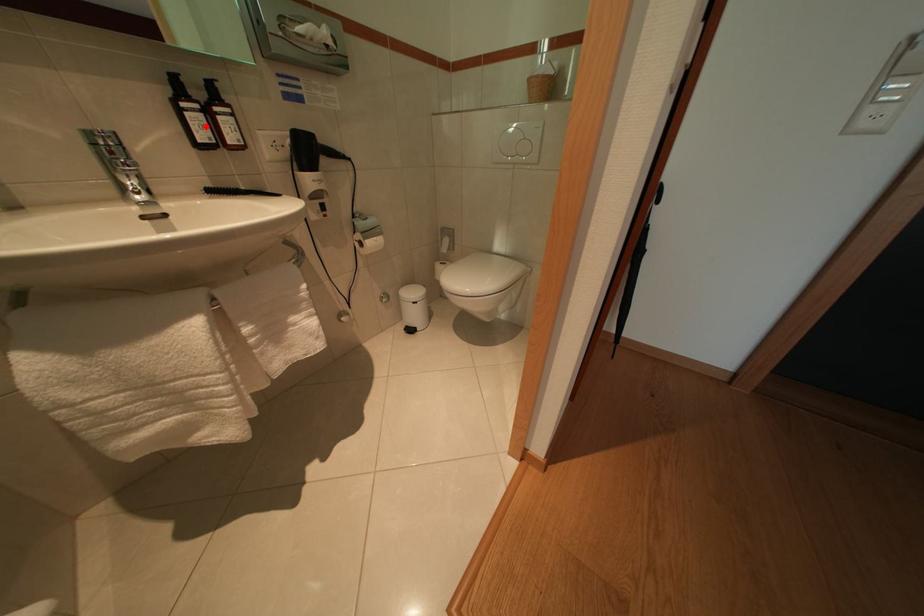
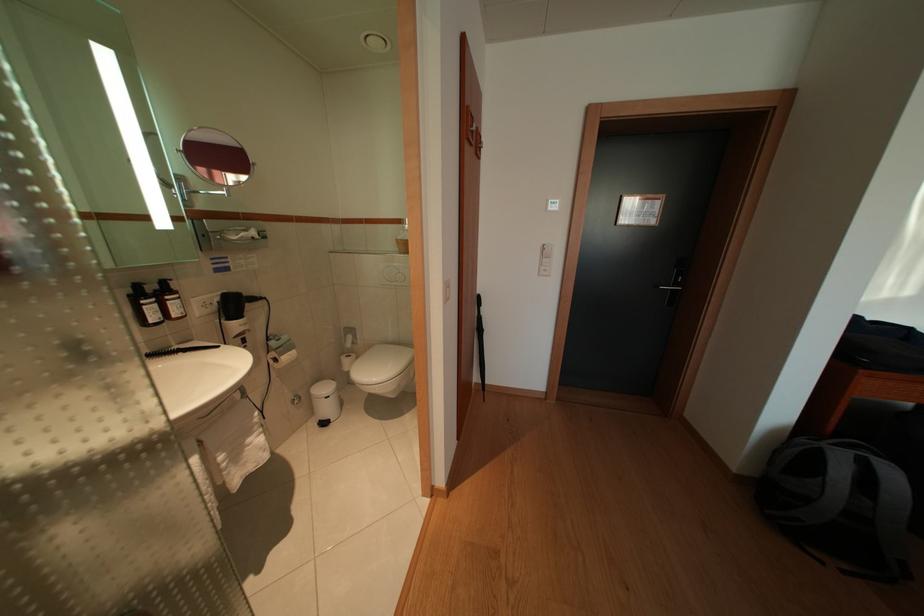
The point at the highlighted location is marked in the first image. Where is the corresponding point in the second image?

(159, 315)